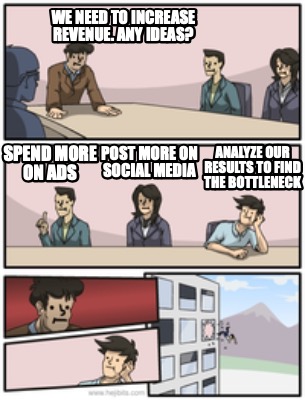
Where is `wall`? This screenshot has height=400, width=305. wall is located at coordinates (110, 200), (61, 366), (102, 299), (37, 19).